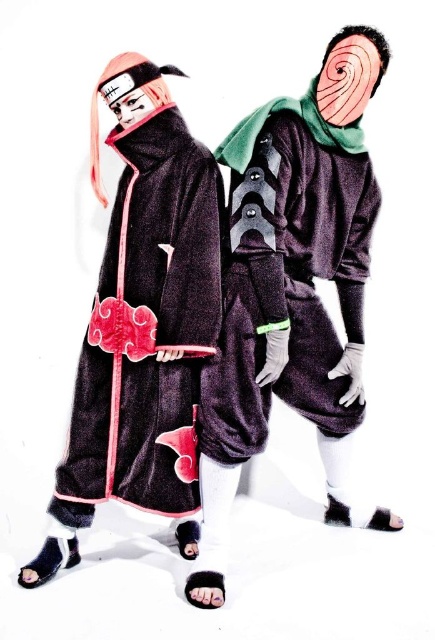
Question: Can you confirm if velvet-like black robe at left is positioned to the right of velvet-like dark purple robe at center?

Choices:
 (A) yes
 (B) no

Answer: (B)

Question: Which point is closer to the camera?

Choices:
 (A) (340, 177)
 (B) (216, 204)

Answer: (B)

Question: Is velvet-like black robe at left thinner than velvet-like dark purple robe at center?

Choices:
 (A) yes
 (B) no

Answer: (A)

Question: Which point appears farthest from the camera in this image?

Choices:
 (A) (217, 150)
 (B) (119, 323)

Answer: (A)

Question: In this image, where is velvet-like black robe at left located relative to velvet-like dark purple robe at center?

Choices:
 (A) below
 (B) above

Answer: (A)